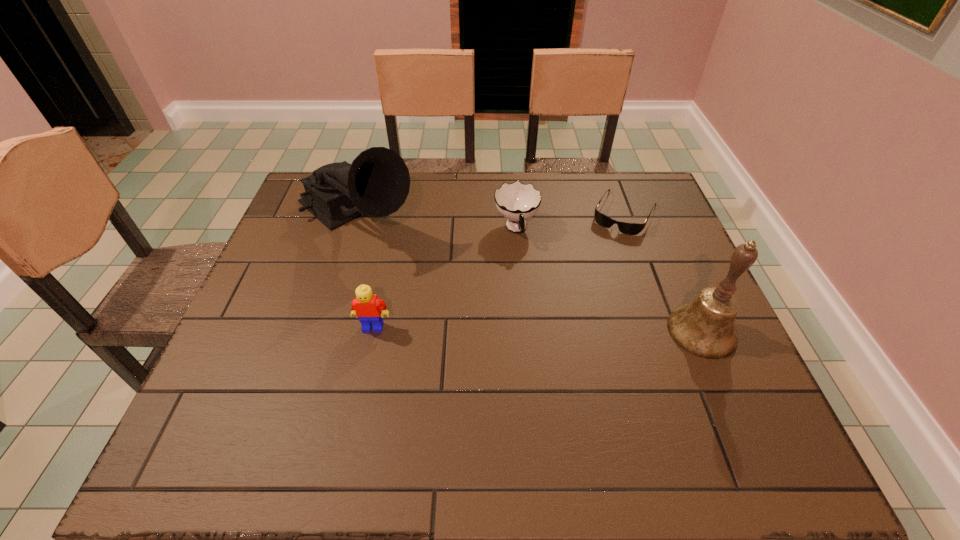
Locate an element on the screen. Image resolution: width=960 pixels, height=540 pixels. object that is at the left edge is located at coordinates (377, 183).

Find the location of a particular element. The height and width of the screenshot is (540, 960). bell positioned at the right edge is located at coordinates (705, 327).

You are a GUI agent. You are given a task and a screenshot of the screen. Output one action in this format:
    pyautogui.click(x=<x>, y=<y>)
    Task: Click on the sunglasses that is at the right edge
    Image resolution: width=960 pixels, height=540 pixels.
    Given the screenshot: What is the action you would take?
    point(627,228)

Where is `object that is at the far left corner`? object that is at the far left corner is located at coordinates (377, 183).

This screenshot has height=540, width=960. I want to click on object positioned at the far right corner, so click(627, 228).

Identify the location of vacant space at the far edge. This screenshot has height=540, width=960. (460, 205).

Where is `vacant space at the near edge of the desktop`? The width and height of the screenshot is (960, 540). vacant space at the near edge of the desktop is located at coordinates (578, 401).

The height and width of the screenshot is (540, 960). Identify the location of blank space at the right edge of the desktop. [x=687, y=274].

I want to click on free space at the near left corner of the desktop, so click(x=235, y=387).

Find the location of a particular element. vacant space at the near right corner of the desktop is located at coordinates (671, 381).